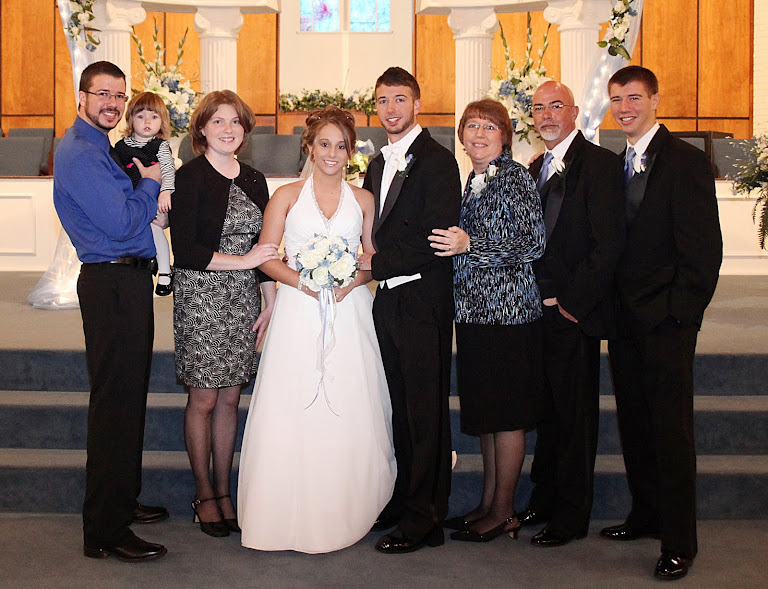
The height and width of the screenshot is (589, 768). Find the location of `potted flowers`. potted flowers is located at coordinates (169, 92), (517, 95).